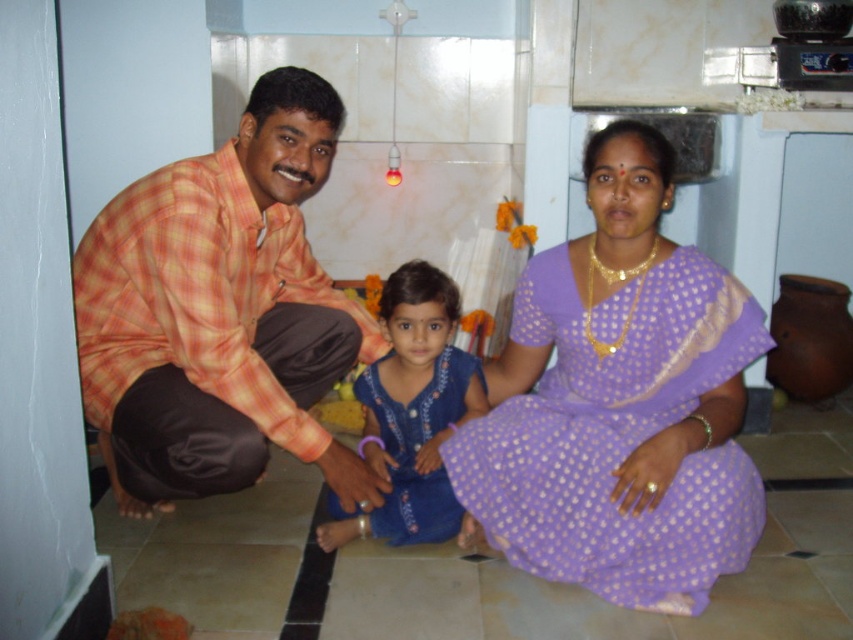
Question: Does orange plaid shirt at left have a greater width compared to blue cotton dress at center?

Choices:
 (A) no
 (B) yes

Answer: (B)

Question: Which point appears closest to the camera in this image?

Choices:
 (A) (451, 440)
 (B) (612, 323)
 (C) (248, 477)

Answer: (B)

Question: Is purple silk saree at center positioned behind orange plaid shirt at left?

Choices:
 (A) yes
 (B) no

Answer: (B)

Question: Is matte orange shirt at left thinner than orange plaid shirt at left?

Choices:
 (A) yes
 (B) no

Answer: (B)

Question: Considering the real-world distances, which object is closest to the matte orange shirt at left?

Choices:
 (A) purple silk saree at center
 (B) blue cotton dress at center
 (C) orange plaid shirt at left

Answer: (A)

Question: Which of the following is the closest to the observer?

Choices:
 (A) matte orange shirt at left
 (B) orange plaid shirt at left
 (C) blue cotton dress at center
 (D) purple silk saree at center

Answer: (D)